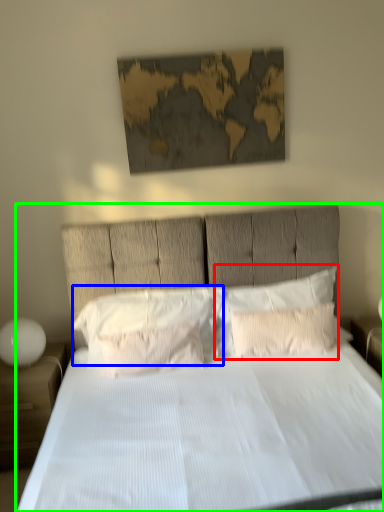
Question: Which object is positioned farthest from pillow (highlighted by a red box)? Select from pillow (highlighted by a blue box) and bed (highlighted by a green box).

Choices:
 (A) pillow
 (B) bed

Answer: (B)